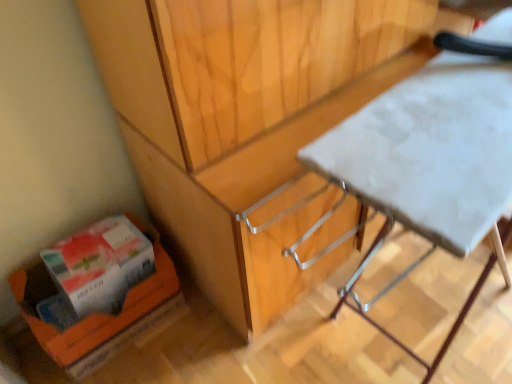
This screenshot has height=384, width=512. I want to click on free spot below white fabric table at center (from a real-world perspective), so click(x=394, y=321).